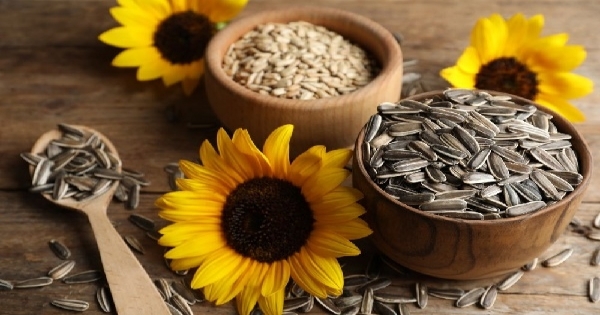
Where is `seeds on table top`? seeds on table top is located at coordinates (484, 302).